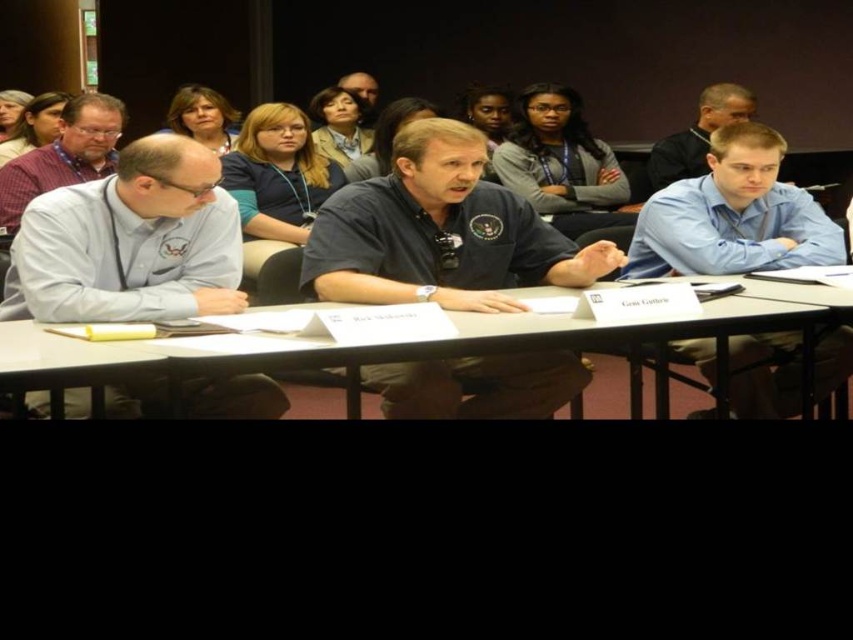
Who is positioned more to the right, matte purple shirt at left or light brown hair at center?

light brown hair at center is more to the right.

Does matte purple shirt at left appear over light brown hair at center?

Incorrect, matte purple shirt at left is not positioned above light brown hair at center.

Between point (24, 188) and point (683, 164), which one is positioned in front?

Point (24, 188)

The image size is (853, 640). In order to click on matte purple shirt at left in this screenshot , I will do `click(62, 156)`.

Does light blue shirt at left appear on the right side of matte purple shirt at left?

Correct, you'll find light blue shirt at left to the right of matte purple shirt at left.

Is light blue shirt at left shorter than matte purple shirt at left?

Yes.

What are the coordinates of `light blue shirt at left` in the screenshot? It's located at (131, 243).

Looking at this image, does blue shirt at right lie behind white plastic table at center?

Yes, it is behind white plastic table at center.

Is point (679, 188) farther from viewer compared to point (19, 332)?

Yes.

Which is behind, point (686, 349) or point (125, 358)?

The point (686, 349) is behind.

Locate an element on the screen. The image size is (853, 640). blue shirt at right is located at coordinates (733, 216).